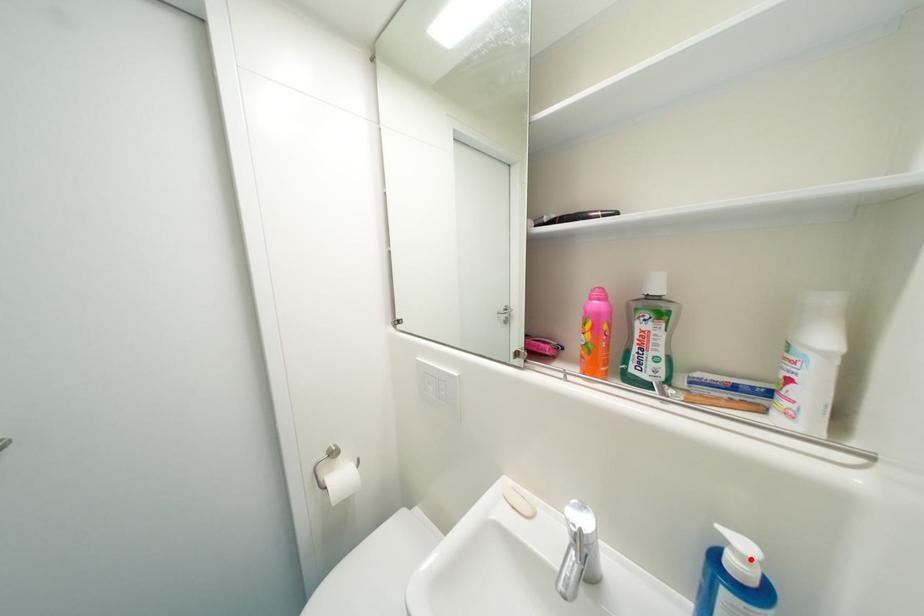
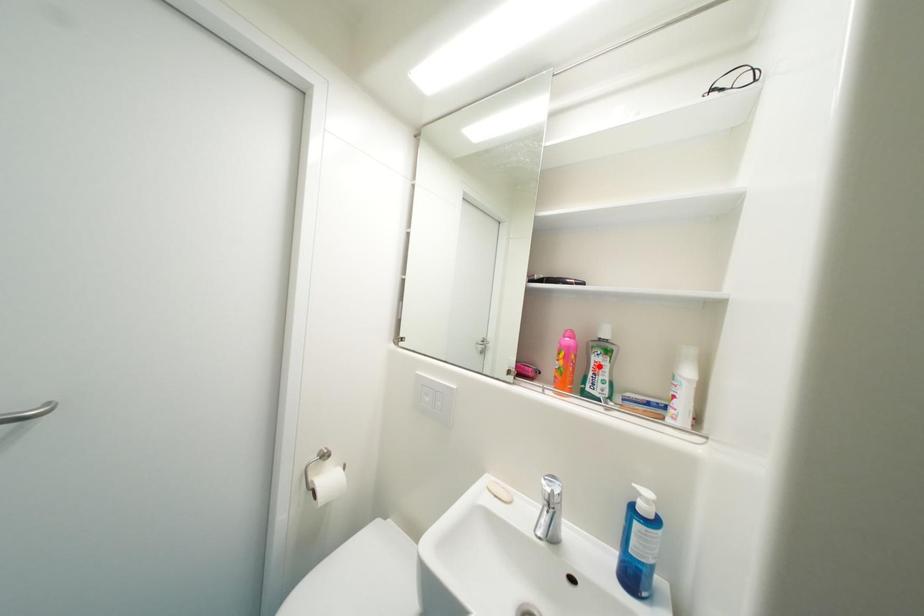
I am providing you with two images of the same scene from different viewpoints. A red point is marked on the first image and another point is marked on the second image. Are the points marked in image1 and image2 representing the same 3D position?

No